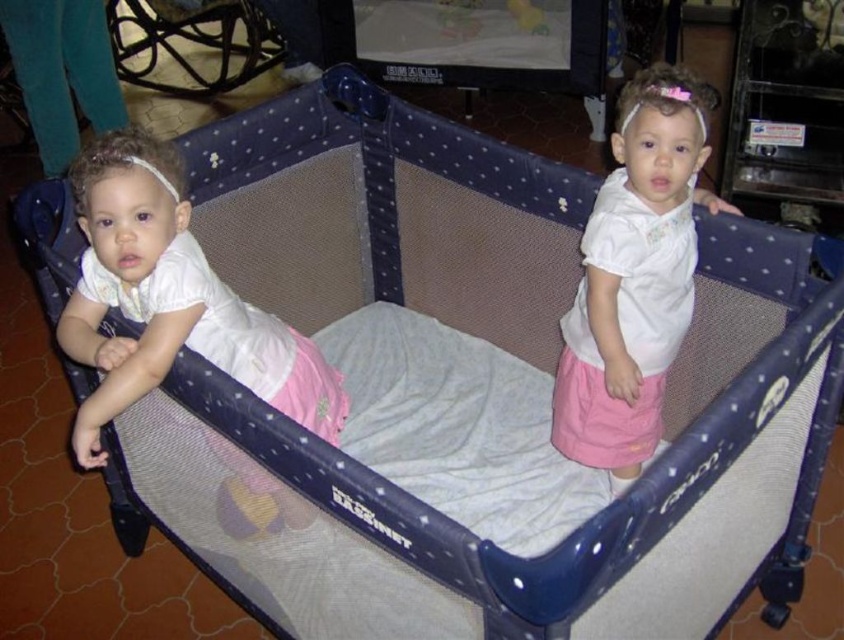
You are a parent holding a matte white dress at left that you want to hand to your child in the playpen. The playpen has a height of 1 meter. Can you determine if the dress is within reach of the child?

The matte white dress at left is 1.31 meters away from the camera, which is beyond the playpen height of 1 meter. Therefore, the child cannot reach the dress.

You are a parent trying to place a new toy in the playpen. The toy requires a space of 0.3 meters by 0.3 meters. Given the location of the matte white dress at left, can you place the toy in the playpen without overlapping it?

The matte white dress at left is located at point (169, 300). Since the playpen has a dark blue frame with white polka dots and a light gray mattress, there should be enough space to place the toy in an area not overlapping with the matte white dress at left as long as the toy is placed at a different coordinate.